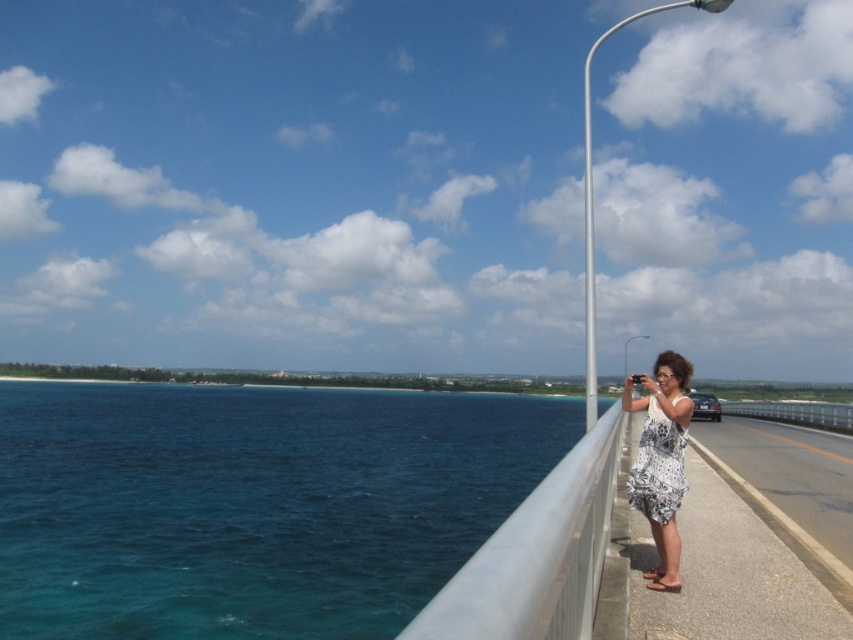
Consider the image. Who is positioned more to the left, blue water at left or silver metallic pole at upper right?

Positioned to the left is blue water at left.

Which of these two, blue water at left or silver metallic pole at upper right, stands shorter?

With less height is blue water at left.

Who is more forward, (x=477, y=538) or (x=590, y=417)?

Positioned in front is point (x=590, y=417).

Locate an element on the screen. blue water at left is located at coordinates (252, 504).

Is point (659, 458) closer to viewer compared to point (625, 353)?

Yes, point (659, 458) is closer to viewer.

Who is positioned more to the right, white dotted dress at right or metallic silver pole at upper center?

Positioned to the right is metallic silver pole at upper center.

Where is `white dotted dress at right`? white dotted dress at right is located at coordinates (660, 460).

You are a GUI agent. You are given a task and a screenshot of the screen. Output one action in this format:
    pyautogui.click(x=<x>, y=<y>)
    Task: Click on the white dotted dress at right
    This screenshot has height=640, width=853.
    Given the screenshot: What is the action you would take?
    pyautogui.click(x=660, y=460)

Who is positioned more to the left, blue water at left or white dotted dress at right?

blue water at left

I want to click on blue water at left, so click(x=252, y=504).

Is point (74, 593) in front of point (682, 452)?

No, (74, 593) is further to viewer.

Identify the location of blue water at left. Image resolution: width=853 pixels, height=640 pixels. (252, 504).